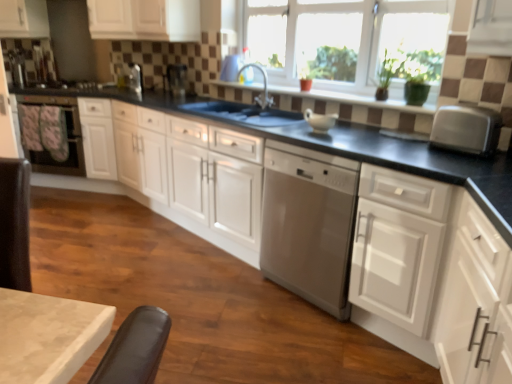
Find the location of a particular element. Image resolution: width=512 pixels, height=384 pixels. vacant region to the left of white matte cabinet at right, the fourth cabinetry positioned from the left is located at coordinates (316, 346).